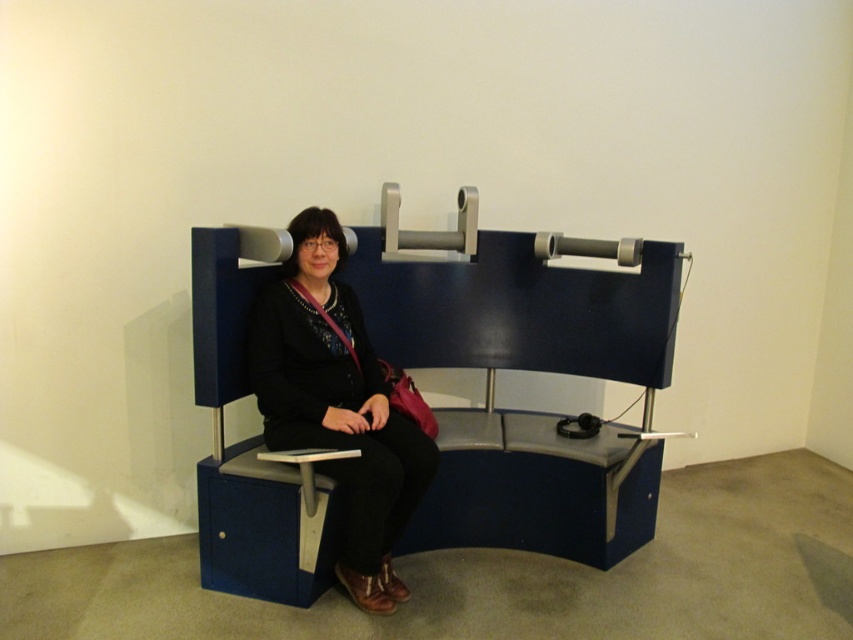
You are trying to decide whether to sit on the blue plastic bench at center while wearing your matte black jacket at center. Considering the height of the bench, will your jacket get wrinkled from the pressure of sitting?

The blue plastic bench at center is much taller than the matte black jacket at center, so sitting on it would likely cause the matte black jacket at center to wrinkle due to the pressure from the bench height difference.

You are trying to determine if the matte black jacket at center can be placed on the blue plastic bench at center without folding it. Based on the scene description, can you confirm if the bench is wide enough?

The blue plastic bench at center might be wider than matte black jacket at center, so it is possible that the bench can accommodate the jacket without folding it. However, the exact dimensions are not provided, so this is an estimate.